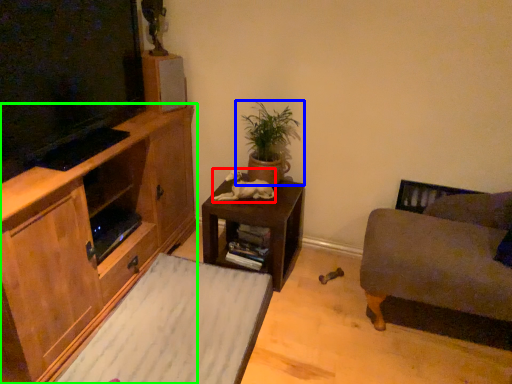
Question: Which object is the closest to the animal (highlighted by a red box)? Choose among these: houseplant (highlighted by a blue box) or cabinetry (highlighted by a green box).

Choices:
 (A) houseplant
 (B) cabinetry

Answer: (A)